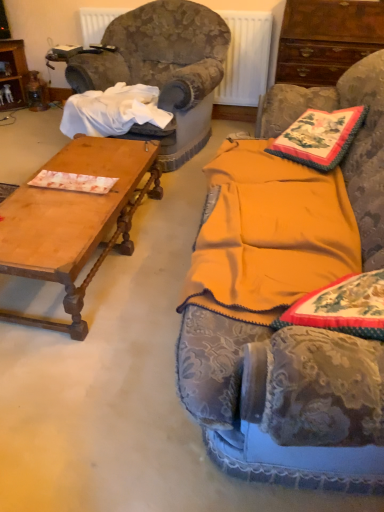
The height and width of the screenshot is (512, 384). Find the location of `empty space that is to the right of wooden polished coffee table at left`. empty space that is to the right of wooden polished coffee table at left is located at coordinates (163, 245).